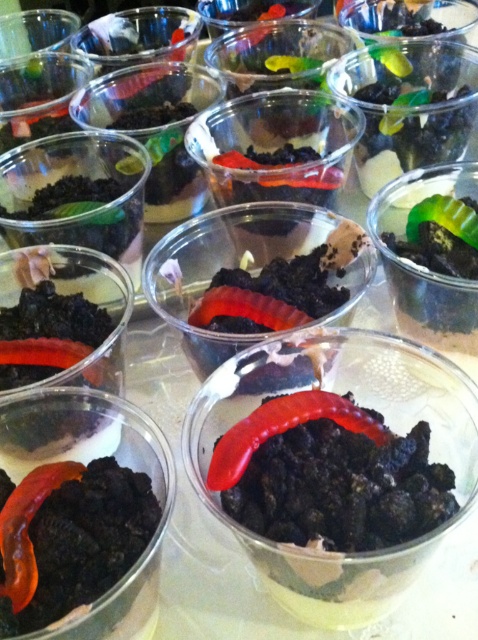
Does point (153, 276) lie in front of point (279, 401)?

No, it is behind (279, 401).

Image resolution: width=478 pixels, height=640 pixels. What do you see at coordinates (227, 266) in the screenshot?
I see `matte plastic bowl at center` at bounding box center [227, 266].

Who is more distant from viewer, (205, 358) or (220, 448)?

A: The point (205, 358) is more distant.

Where is `matte plastic bowl at center`? matte plastic bowl at center is located at coordinates (227, 266).

Is matte plastic bowl at center smaller than rubbery red worm at lower left?

No.

Does point (294, 211) come farther from viewer compared to point (29, 600)?

Yes, it is behind point (29, 600).

What do you see at coordinates (227, 266) in the screenshot?
I see `matte plastic bowl at center` at bounding box center [227, 266].

Find the location of a particular element. matte plastic bowl at center is located at coordinates [x=227, y=266].

Which is below, orange rubber worm at center or rubbery red worm at center?

Positioned lower is orange rubber worm at center.

Which is more to the left, orange rubber worm at center or rubbery red worm at center?

Positioned to the left is orange rubber worm at center.

Where is `orange rubber worm at center`? orange rubber worm at center is located at coordinates (85, 541).